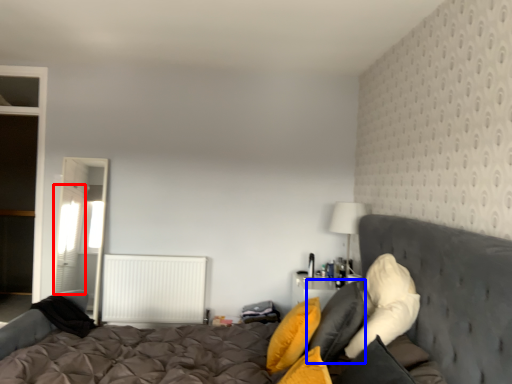
Question: Which object appears farthest to the camera in this image, curtain (highlighted by a red box) or pillow (highlighted by a blue box)?

Choices:
 (A) curtain
 (B) pillow

Answer: (A)